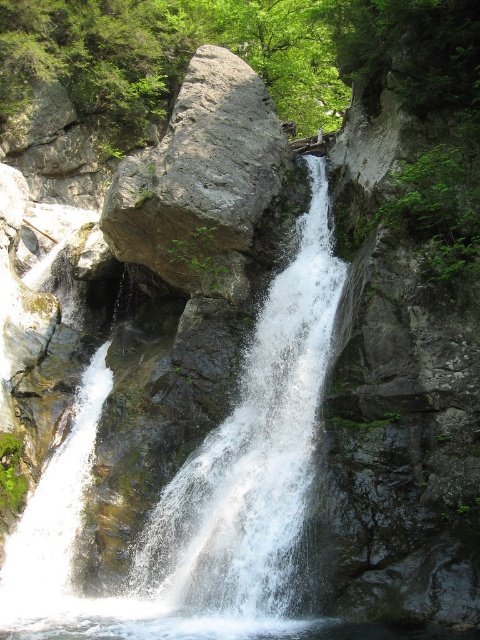
You are standing at the point marked as point (252, 452) in the image. What do you see around you?

You are standing at the white frothy water at center, which is located at point (252, 452). Around you, you would see the cascading waterfall flowing over rugged dark gray rocks with moss and green algae, surrounded by lush green foliage and trees in a vibrant spring setting.

You are standing at the edge of the waterfall and want to place a small statue between the white frothy water at center and the gray rock at center. According to the scene, where should you position the statue to ensure it is between these two objects?

The white frothy water at center is to the right of the gray rock at center, so you should place the statue between them by positioning it to the right of the gray rock at center but left of the white frothy water at center.

You are a photographer planning to capture the waterfall and its surroundings. You want to ensure that the white frothy water at center and the gray rock at center are both clearly visible in your shot. Given their sizes, which object should you focus on to ensure both are in frame without needing to adjust your camera angle?

The white frothy water at center has a smaller width than the gray rock at center. To ensure both are in frame, focus on the gray rock at center since it is wider and will help frame the shot appropriately while the smaller white frothy water at center will naturally fit within the composition.